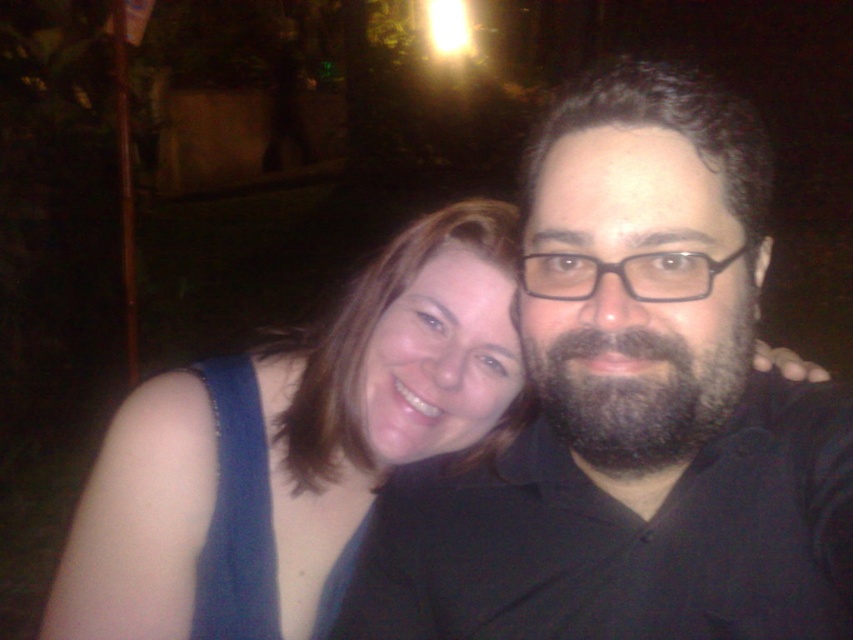
Question: Is black matte shirt at center below blue fabric dress at center?

Choices:
 (A) yes
 (B) no

Answer: (B)

Question: Which point is closer to the camera?

Choices:
 (A) (409, 593)
 (B) (583, 380)
 (C) (234, 428)
 (D) (358, 348)

Answer: (B)

Question: Considering the real-world distances, which object is farthest from the denim fabric dress at left?

Choices:
 (A) black matte shirt at center
 (B) dark brown thick beard at center
 (C) blue fabric dress at center

Answer: (B)

Question: Which point is closer to the camera taking this photo?

Choices:
 (A) (714, 337)
 (B) (401, 588)
 (C) (259, 637)
 (D) (315, 518)

Answer: (A)

Question: Does black matte shirt at center appear on the right side of denim fabric dress at left?

Choices:
 (A) no
 (B) yes

Answer: (B)

Question: Can you confirm if dark brown thick beard at center is smaller than denim fabric dress at left?

Choices:
 (A) yes
 (B) no

Answer: (A)